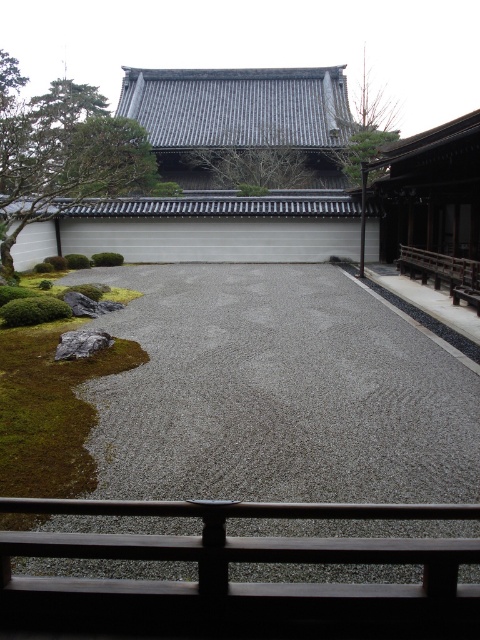
You are standing in the Japanese garden and want to walk towards the central structure. According to the image, where is the gray gravel at center located in terms of coordinates?

The gray gravel at center is located at coordinates point (278, 394).